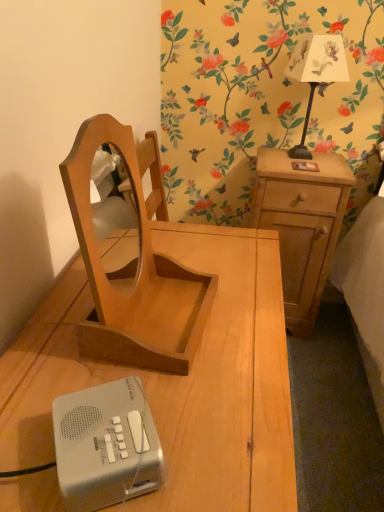
The height and width of the screenshot is (512, 384). In order to click on vacant point above light brown wood at right, the second nightstand positioned from the front (from a real-world perspective) in this screenshot , I will do `click(297, 162)`.